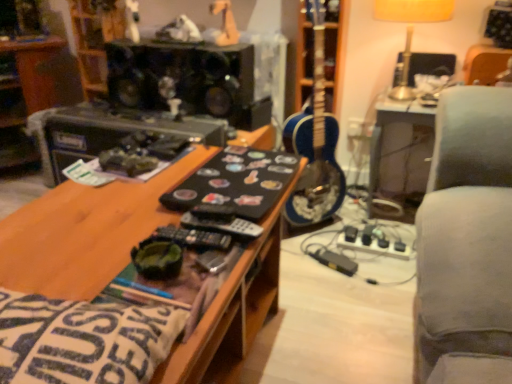
Where is `free space between white plush toy at upper center, acting as the second toy starting from the left, and matte plastic toy at upper center, the 3th toy in the left-to-right sequence`? free space between white plush toy at upper center, acting as the second toy starting from the left, and matte plastic toy at upper center, the 3th toy in the left-to-right sequence is located at coordinates pos(193,44).